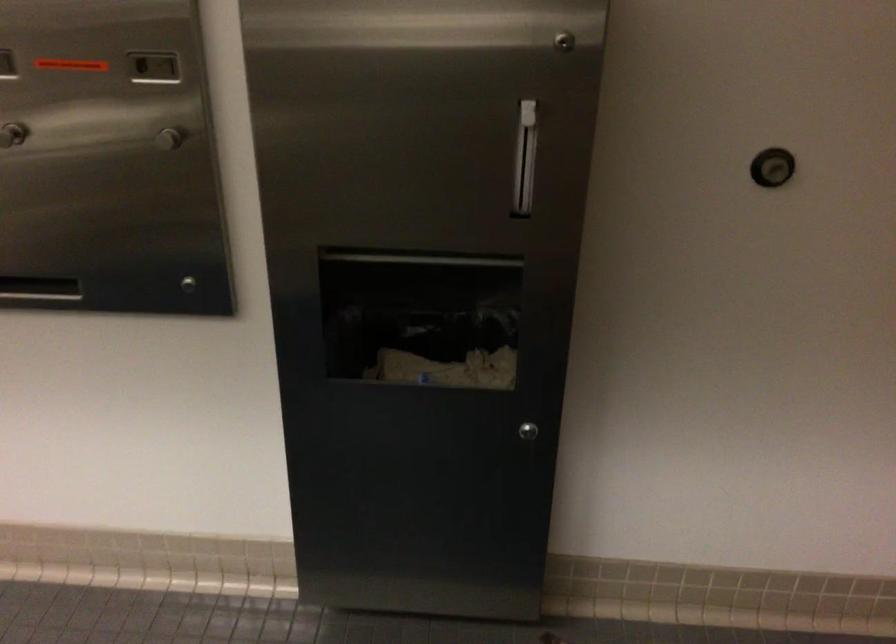
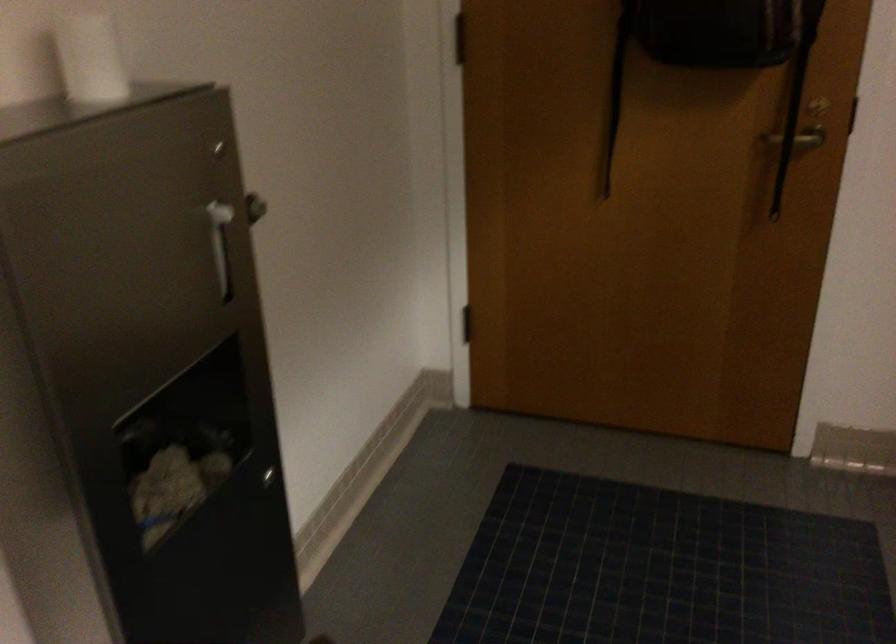
In the second image, find the point that corresponds to (x=495, y=151) in the first image.

(220, 243)